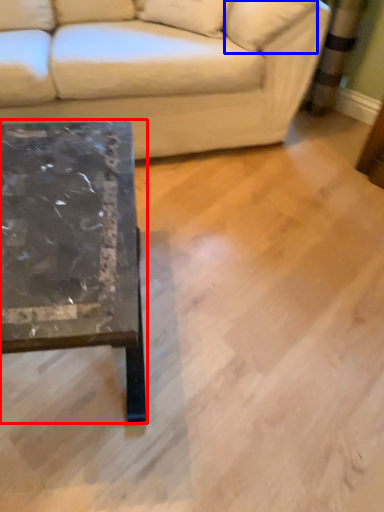
Question: Which object is further to the camera taking this photo, coffee table (highlighted by a red box) or pillow (highlighted by a blue box)?

Choices:
 (A) coffee table
 (B) pillow

Answer: (B)